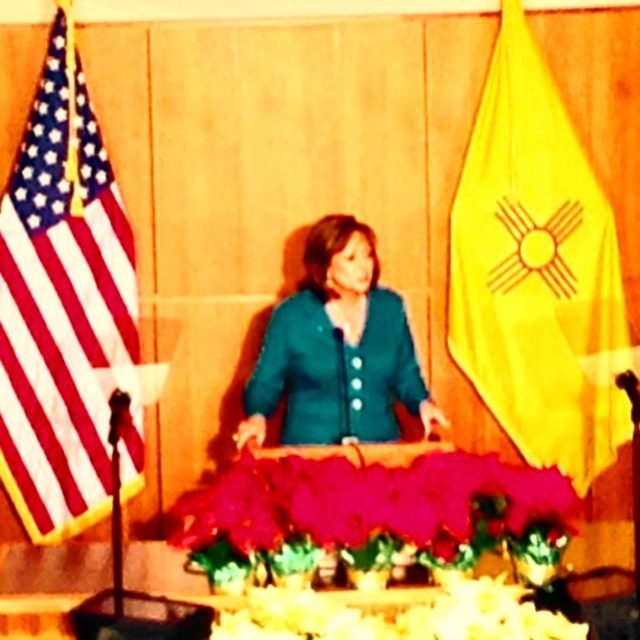
Does yellow fabric flag at right have a lesser width compared to silky pink petals at center?

Indeed, yellow fabric flag at right has a lesser width compared to silky pink petals at center.

Between yellow fabric flag at right and silky pink petals at center, which one appears on the left side from the viewer's perspective?

silky pink petals at center

Is point (520, 424) behind point (364, 512)?

That is True.

The image size is (640, 640). What are the coordinates of `yellow fabric flag at right` in the screenshot? It's located at (538, 272).

How distant is silky pink petals at center from teal fabric jacket at center?

A distance of 23.97 inches exists between silky pink petals at center and teal fabric jacket at center.

Consider the image. Which is below, silky pink petals at center or teal fabric jacket at center?

silky pink petals at center is lower down.

Between point (218, 502) and point (300, 339), which one is positioned in front?

Point (218, 502) is in front.

Where is `silky pink petals at center`? This screenshot has width=640, height=640. silky pink petals at center is located at coordinates (369, 506).

Between point (48, 470) and point (525, 612), which one is positioned in front?

Point (525, 612)

Is point (58, 410) closer to camera compared to point (580, 636)?

No, (58, 410) is further to viewer.

Find the location of a particular element. The height and width of the screenshot is (640, 640). american flag at left is located at coordinates (61, 304).